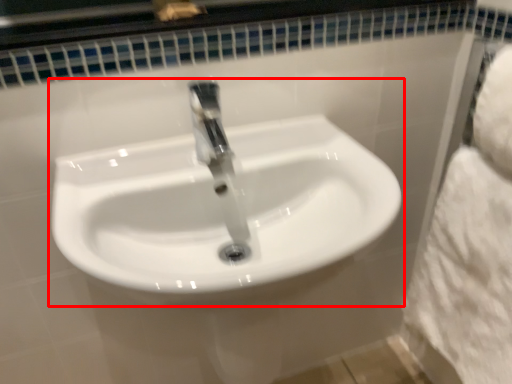
Question: Where is sink (annotated by the red box) located in relation to bath towel in the image?

Choices:
 (A) left
 (B) right

Answer: (A)